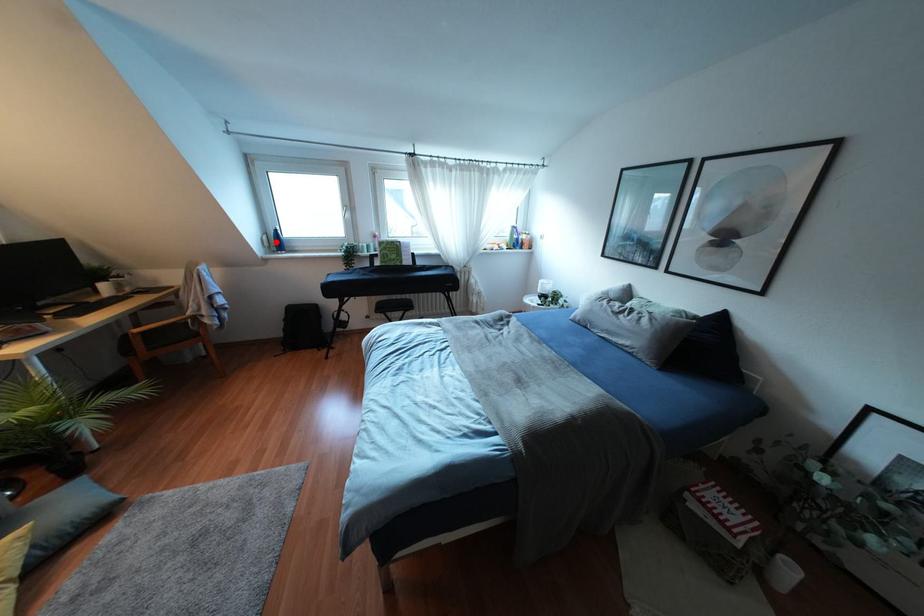
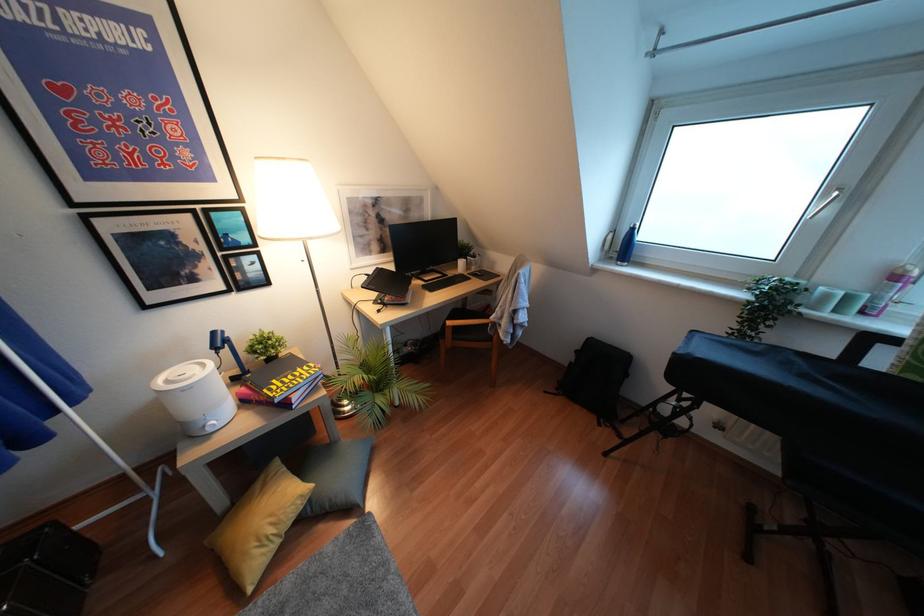
Find the pixel in the second image that matches the highlighted location in the first image.

(623, 246)